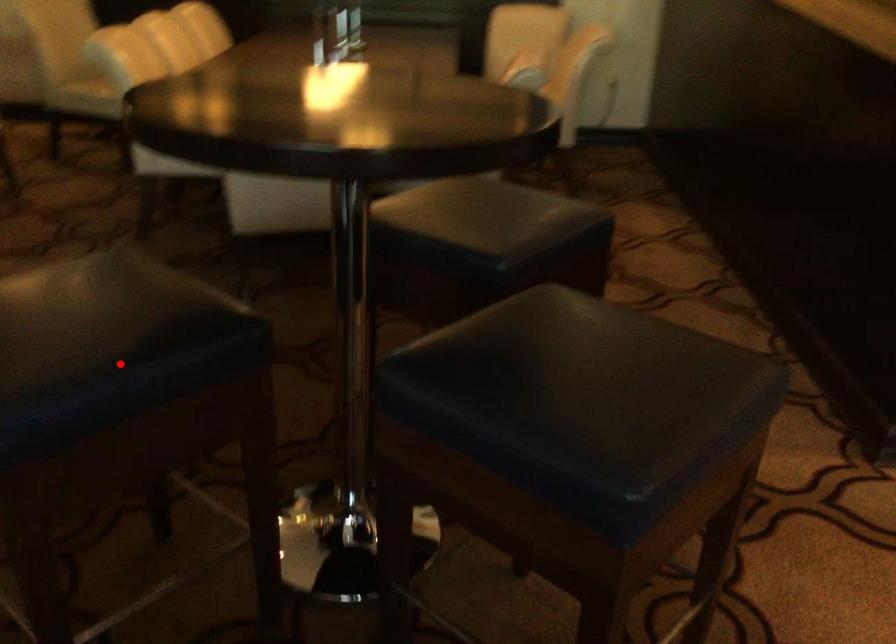
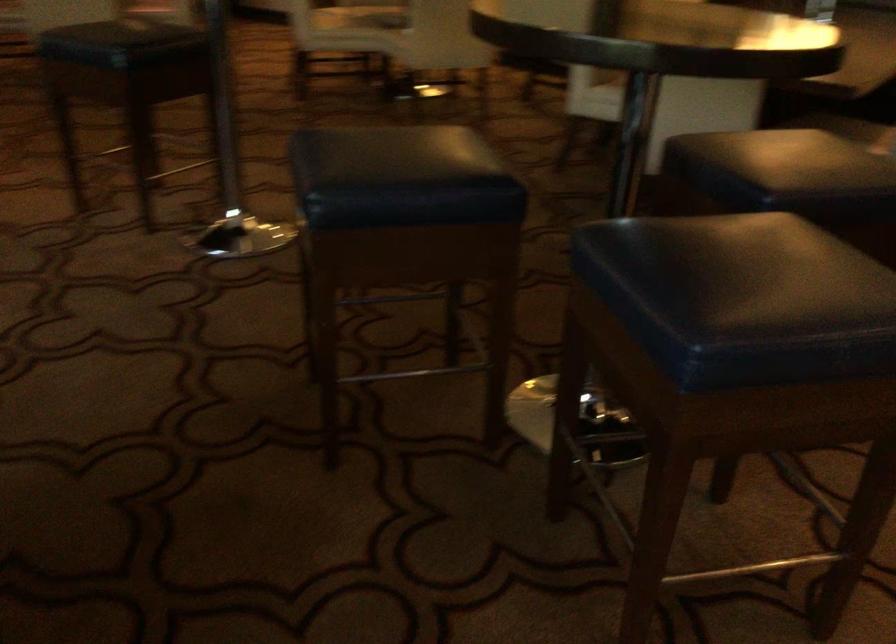
Question: I am providing you with two images of the same scene from different viewpoints. Image1 has a red point marked. In image2, the corresponding 3D location appears at what relative position? Reply with the corresponding letter.

Choices:
 (A) Closer
 (B) Farther

Answer: (B)